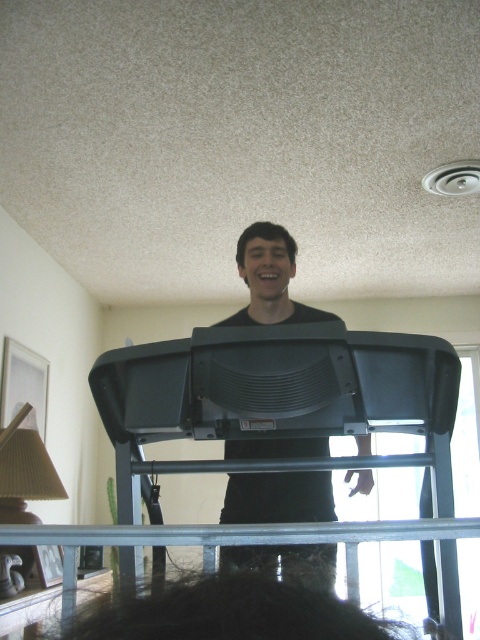
Question: Is black plastic ladder at center thinner than metal/textured rail at lower center?

Choices:
 (A) no
 (B) yes

Answer: (B)

Question: Which object is the farthest from the metal/textured rail at lower center?

Choices:
 (A) black matte treadmill at center
 (B) black plastic ladder at center

Answer: (A)

Question: Is black plastic ladder at center bigger than metal/textured rail at lower center?

Choices:
 (A) no
 (B) yes

Answer: (B)

Question: Which of the following is the closest to the observer?

Choices:
 (A) (430, 397)
 (B) (312, 520)

Answer: (A)

Question: Does black plastic ladder at center appear on the right side of black matte treadmill at center?

Choices:
 (A) no
 (B) yes

Answer: (B)

Question: Among these objects, which one is nearest to the camera?

Choices:
 (A) black matte treadmill at center
 (B) black plastic ladder at center
 (C) metal/textured rail at lower center

Answer: (A)